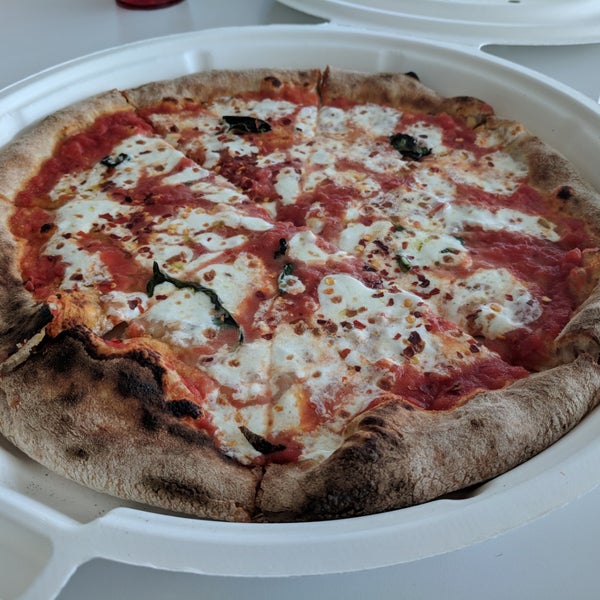
Identify the location of counter. (561, 561), (49, 37), (568, 71), (568, 357).